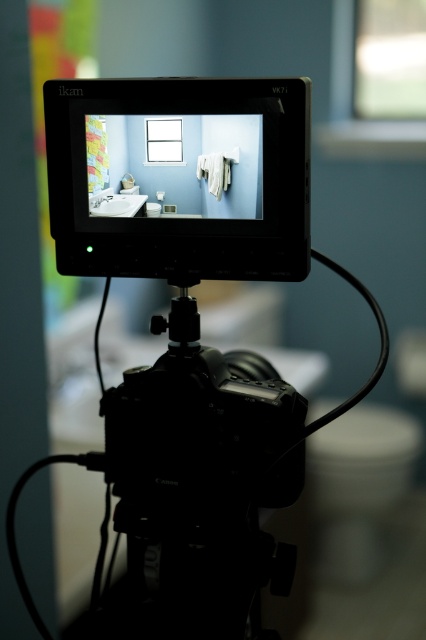
You are a camera operator setting up a shot for a bathroom scene. You have to decide whether to frame the white glossy toilet bowl at lower right and the white glossy sink at center in a single shot. Given their widths, which object will require more horizontal space in the frame?

The white glossy toilet bowl at lower right requires more horizontal space in the frame because its width surpasses that of the white glossy sink at center.